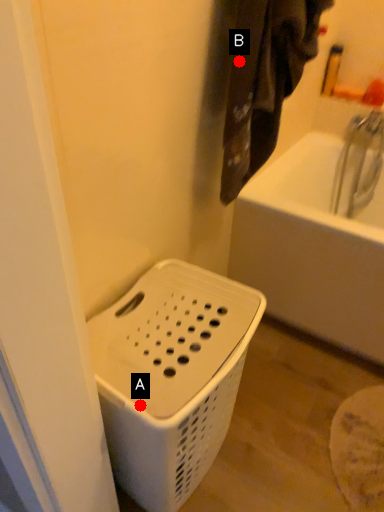
Question: Two points are circled on the image, labeled by A and B beside each circle. Which point is closer to the camera taking this photo?

Choices:
 (A) A is closer
 (B) B is closer

Answer: (A)